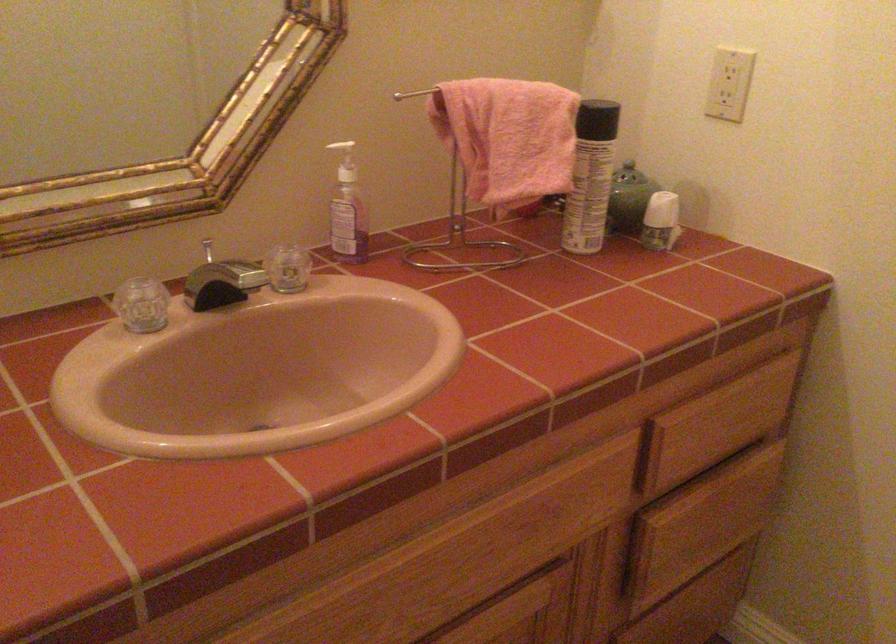
Image resolution: width=896 pixels, height=644 pixels. What do you see at coordinates (345, 161) in the screenshot? I see `a soap dispenser pump` at bounding box center [345, 161].